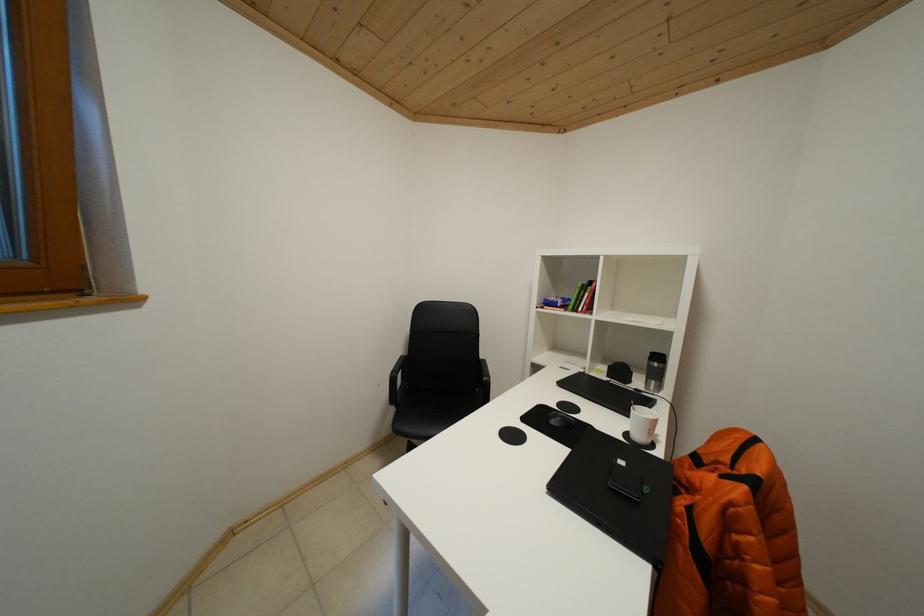
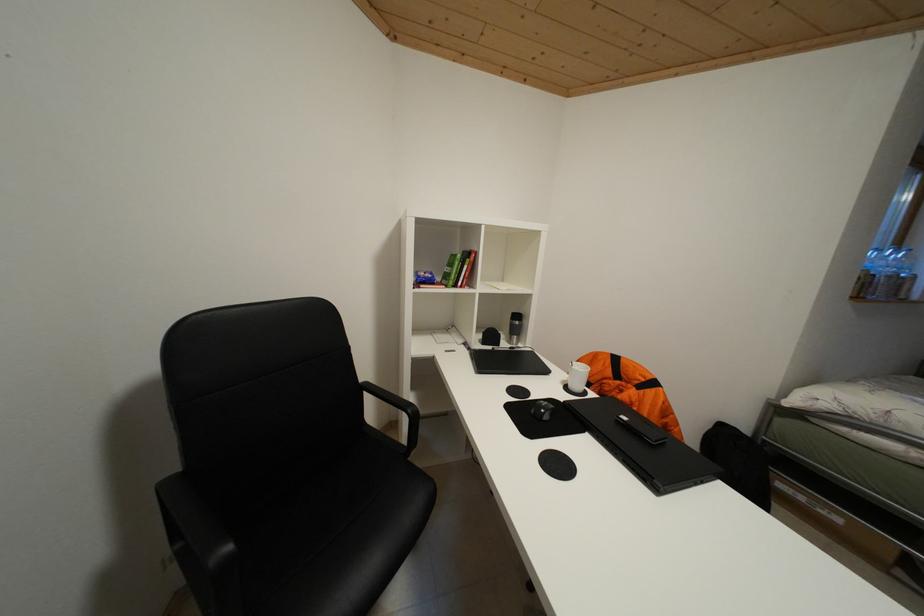
Question: Based on the continuous images, in which direction is the camera rotating? Reply with the corresponding letter.

Choices:
 (A) Left
 (B) Right
 (C) Up
 (D) Down

Answer: (B)